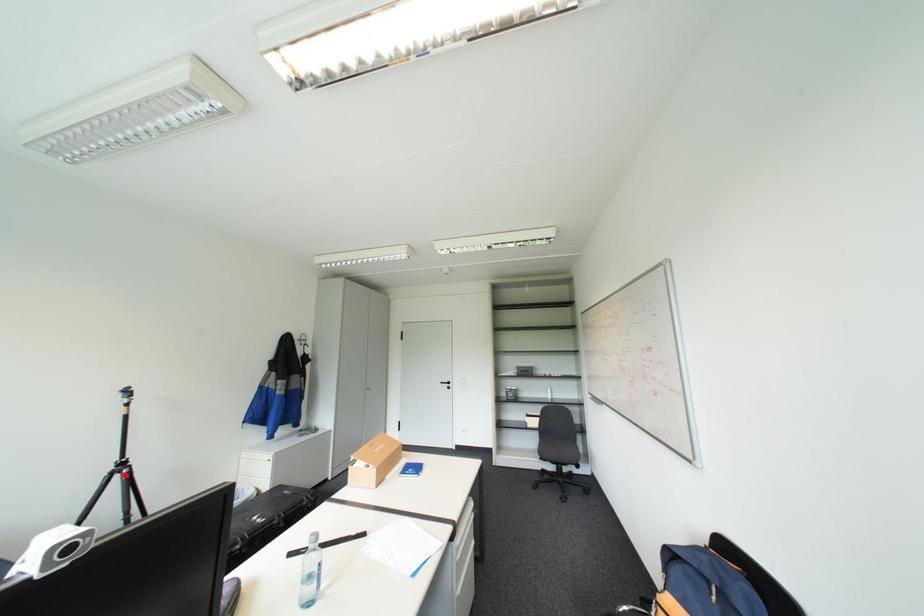
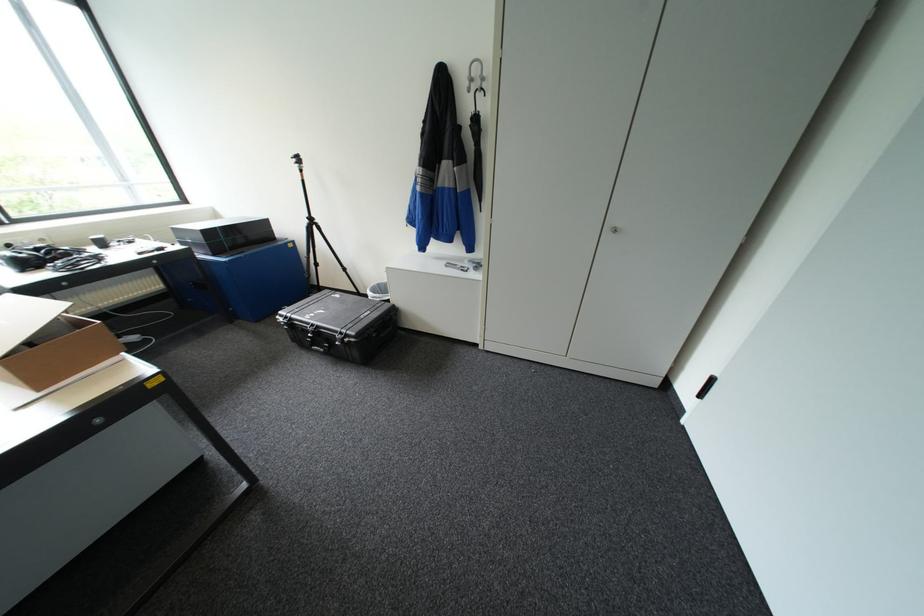
Locate, in the second image, the point that corresponds to the highlighted location in the first image.

(318, 225)